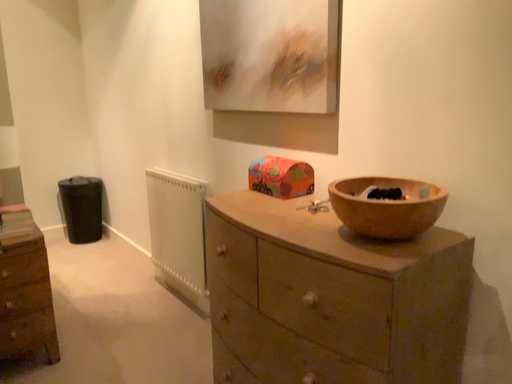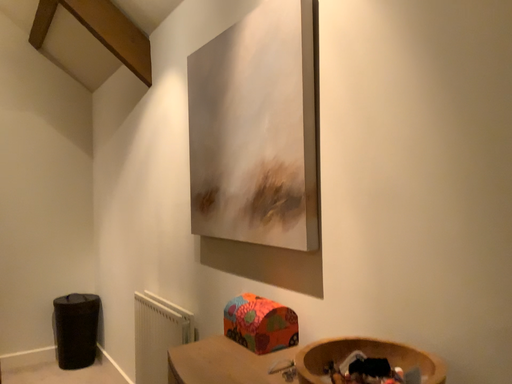
Question: How did the camera likely rotate when shooting the video?

Choices:
 (A) rotated downward
 (B) rotated upward

Answer: (B)